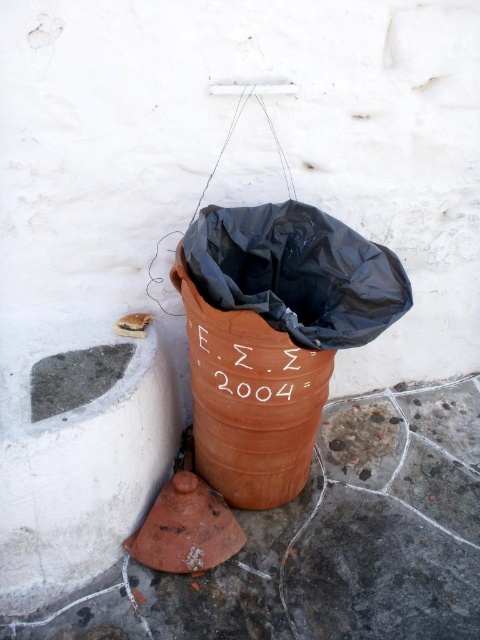
Does smooth concrete pavement at lower left appear over terracotta textured barrel at center?

No.

Based on the photo, who is more distant from viewer, (86, 589) or (233, 486)?

Point (233, 486)

In order to click on smooth concrete pavement at lower left in this screenshot , I will do `click(326, 541)`.